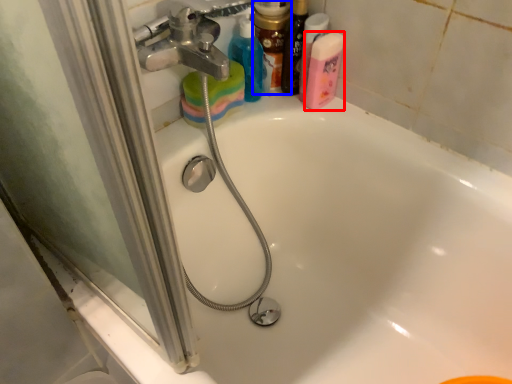
Question: Among these objects, which one is nearest to the camera, cleaning product (highlighted by a red box) or toiletry (highlighted by a blue box)?

Choices:
 (A) cleaning product
 (B) toiletry

Answer: (A)